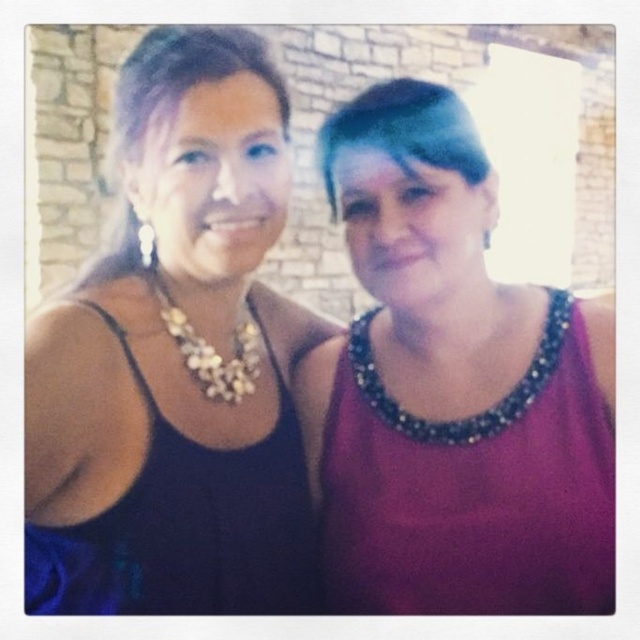
You are taking a photo of two people standing against a brick wall. You notice two points marked on your camera screen at coordinates point (208, 346) and point (145, 260). If you want to focus on the point that is closer to the camera, which coordinate should you choose?

You should focus on point (208, 346) because it is closer to the camera than point (145, 260).

You are a photographer adjusting the lighting for a shoot. You notice the purple beaded tank top at right and the gold metallic necklace at upper center. Which object should you focus on first to ensure proper reflection capture?

The purple beaded tank top at right is in front of the gold metallic necklace at upper center, so you should focus on the purple beaded tank top at right first to ensure proper reflection capture.

You are a photographer adjusting the lighting for a closeup shot of the two necklaces. You need to ensure both the pearl and glass necklace at center and the gold metallic necklace at upper center are evenly lit. Which necklace should you adjust the light towards to balance the exposure?

The pearl and glass necklace at center is to the right of the gold metallic necklace at upper center, so you should adjust the light towards the pearl and glass necklace at center to balance the exposure between both necklaces.